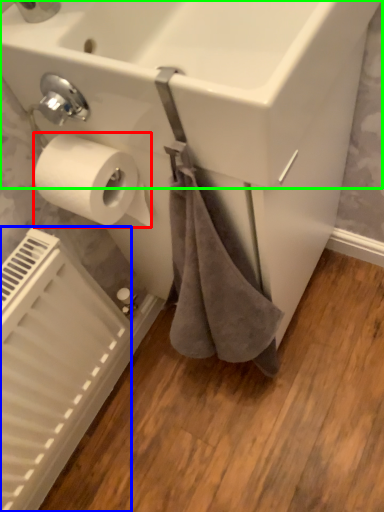
Question: Which object is the farthest from toilet paper (highlighted by a red box)? Choose among these: radiator (highlighted by a blue box) or sink (highlighted by a green box).

Choices:
 (A) radiator
 (B) sink

Answer: (A)